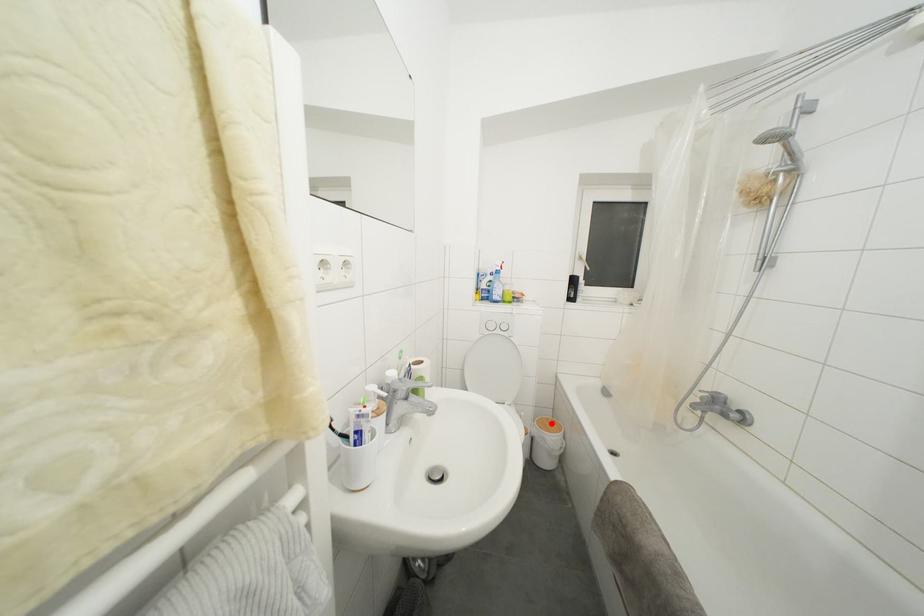
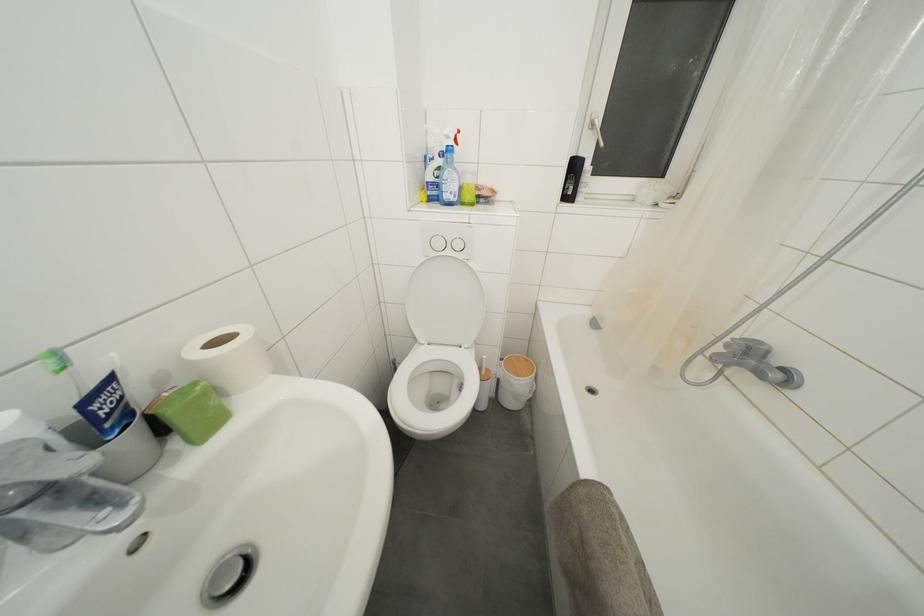
Where in the second image is the point corresponding to the highlighted location from the first image?

(521, 362)